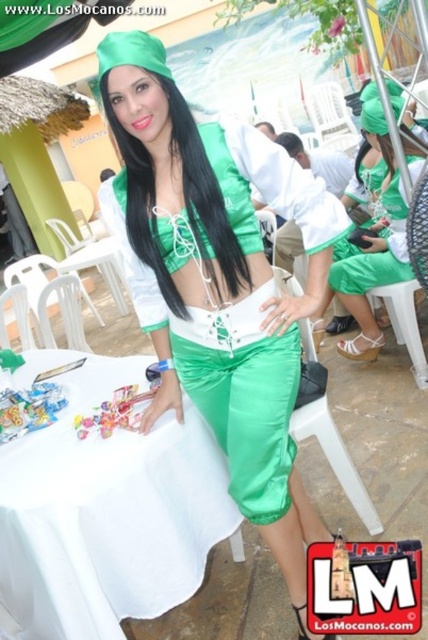
You are a photographer at the event and want to capture a closeup of the woman while ensuring both the shiny green pants at center and the black silky hair at upper center are visible. Which object will appear wider in the photo?

The shiny green pants at center will appear wider in the photo since their width surpasses that of the black silky hair at upper center according to the description.

From the picture: Please describe the position of the black silky hair at center in the image using the coordinate system provided. The coordinate system has its origin at the bottom left corner of the image, with x increasing to the right and y increasing upwards. The values are normalized between 0 and 1.

The black silky hair at center is located at coordinate point 0.227 along the x axis and 0.680 along the y axis.

You are a photographer at a festival event. You want to take a photo of the woman with black silky hair at center from a distance of 3 meters. Can you capture her hair clearly in the photo?

The black silky hair at center and camera are 3.34 meters apart, so yes, you can capture her hair clearly from 3 meters since the distance is slightly less than the required 3.34 meters.